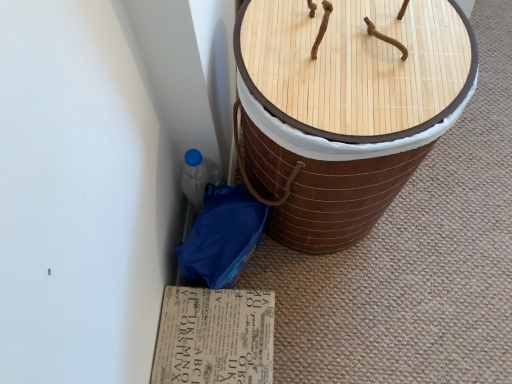
This screenshot has width=512, height=384. What do you see at coordinates (214, 337) in the screenshot?
I see `printed cardboard at lower center` at bounding box center [214, 337].

You are a GUI agent. You are given a task and a screenshot of the screen. Output one action in this format:
    pyautogui.click(x=<x>, y=<y>)
    Task: Click on the printed cardboard at lower center
    Image resolution: width=512 pixels, height=384 pixels.
    Given the screenshot: What is the action you would take?
    pyautogui.click(x=214, y=337)

This screenshot has width=512, height=384. What do you see at coordinates (345, 108) in the screenshot?
I see `bamboo basket at center` at bounding box center [345, 108].

Identify the location of bamboo basket at center. The height and width of the screenshot is (384, 512). (345, 108).

Find the location of a particular element. Image resolution: width=512 pixels, height=384 pixels. printed cardboard at lower center is located at coordinates (214, 337).

Which object is positioned more to the right, bamboo basket at center or printed cardboard at lower center?

From the viewer's perspective, bamboo basket at center appears more on the right side.

Which object is further away from the camera taking this photo, bamboo basket at center or printed cardboard at lower center?

printed cardboard at lower center is further from the camera.

Which is closer to the camera, (357, 49) or (234, 340)?

Clearly, point (357, 49) is closer to the camera than point (234, 340).

From the image's perspective, which one is positioned higher, bamboo basket at center or printed cardboard at lower center?

bamboo basket at center, from the image's perspective.

From a real-world perspective, is bamboo basket at center above or below printed cardboard at lower center?

bamboo basket at center is situated higher than printed cardboard at lower center in the real world.

Between bamboo basket at center and printed cardboard at lower center, which one has larger width?

With larger width is bamboo basket at center.

Which of these two, bamboo basket at center or printed cardboard at lower center, stands taller?

Standing taller between the two is bamboo basket at center.

Looking at this image, considering the sizes of objects bamboo basket at center and printed cardboard at lower center in the image provided, who is bigger, bamboo basket at center or printed cardboard at lower center?

bamboo basket at center is bigger.

Is bamboo basket at center inside the boundaries of printed cardboard at lower center, or outside?

bamboo basket at center is spatially situated outside printed cardboard at lower center.

Is bamboo basket at center next to printed cardboard at lower center?

No, bamboo basket at center is not in contact with printed cardboard at lower center.

Consider the image. Is bamboo basket at center looking in the opposite direction of printed cardboard at lower center?

bamboo basket at center is not turned away from printed cardboard at lower center.

How far apart are bamboo basket at center and printed cardboard at lower center?

bamboo basket at center is 14.38 inches from printed cardboard at lower center.

This screenshot has height=384, width=512. I want to click on cardboard that appears below the bamboo basket at center (from the image's perspective), so click(x=214, y=337).

Does printed cardboard at lower center appear on the right side of bamboo basket at center?

In fact, printed cardboard at lower center is to the left of bamboo basket at center.

Is printed cardboard at lower center positioned in front of bamboo basket at center?

No, printed cardboard at lower center is further to the viewer.

Which is farther from the camera, (201, 293) or (407, 41)?

The point (201, 293) is farther from the camera.

From the image's perspective, which is above, printed cardboard at lower center or bamboo basket at center?

bamboo basket at center.

From a real-world perspective, is printed cardboard at lower center above or below bamboo basket at center?

Clearly, from a real-world perspective, printed cardboard at lower center is below bamboo basket at center.

Between printed cardboard at lower center and bamboo basket at center, which one has smaller width?

printed cardboard at lower center.

Based on the photo, does printed cardboard at lower center have a lesser height compared to bamboo basket at center?

Correct, printed cardboard at lower center is not as tall as bamboo basket at center.

Considering the sizes of printed cardboard at lower center and bamboo basket at center in the image, is printed cardboard at lower center bigger or smaller than bamboo basket at center?

Considering their sizes, printed cardboard at lower center takes up less space than bamboo basket at center.

Is printed cardboard at lower center spatially inside bamboo basket at center, or outside of it?

printed cardboard at lower center is not enclosed by bamboo basket at center.

Looking at this image, is printed cardboard at lower center far from bamboo basket at center?

No.

Is printed cardboard at lower center oriented towards bamboo basket at center?

No, printed cardboard at lower center is not facing towards bamboo basket at center.

What's the angular difference between printed cardboard at lower center and bamboo basket at center's facing directions?

The facing directions of printed cardboard at lower center and bamboo basket at center are 0.000511 degrees apart.

Where is `furniture located on the right of printed cardboard at lower center`? This screenshot has width=512, height=384. furniture located on the right of printed cardboard at lower center is located at coordinates (345, 108).

At what (x,y) coordinates should I click in order to perform the action: click on furniture above the printed cardboard at lower center (from a real-world perspective). Please return your answer as a coordinate pair (x, y). Looking at the image, I should click on (345, 108).

Image resolution: width=512 pixels, height=384 pixels. Find the location of `furniture above the printed cardboard at lower center (from the image's perspective)`. furniture above the printed cardboard at lower center (from the image's perspective) is located at coordinates (345, 108).